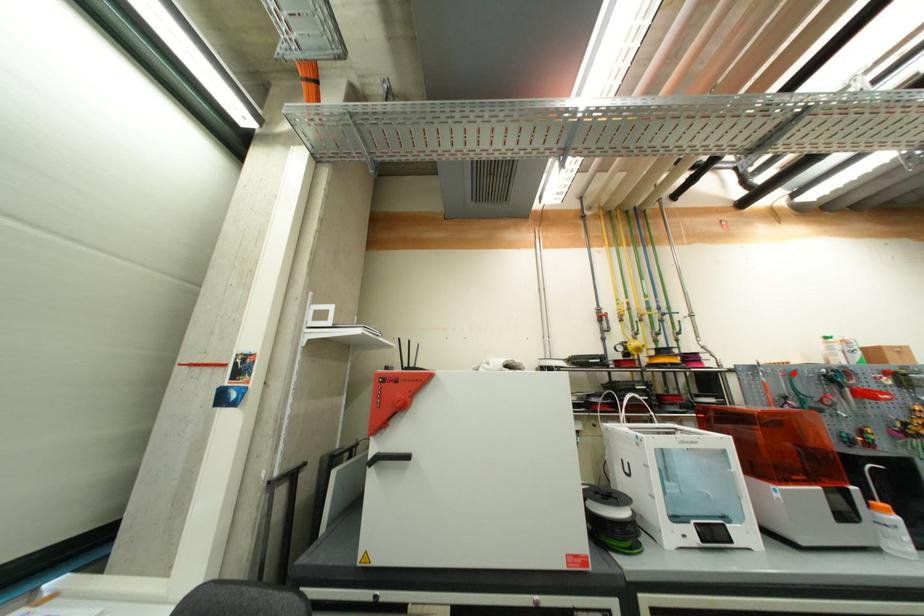
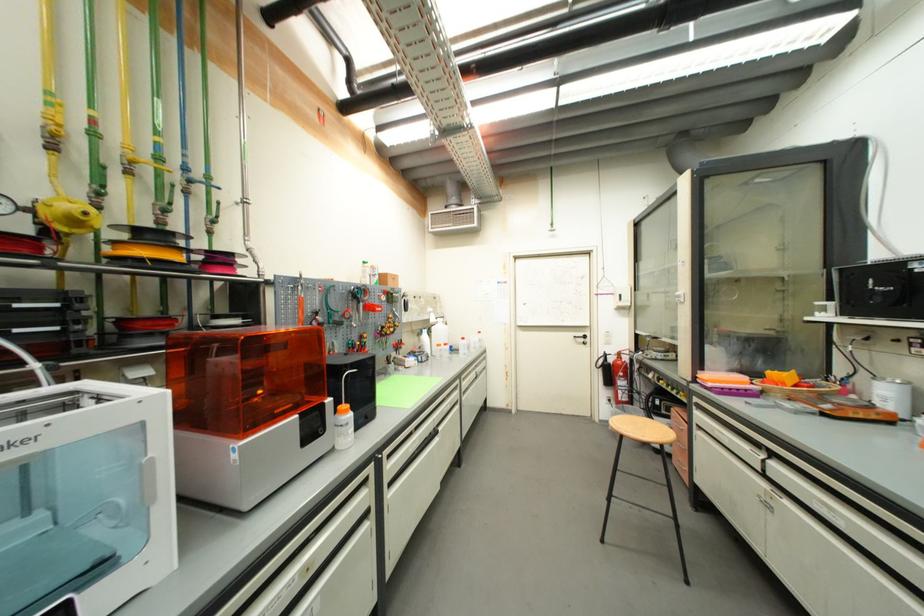
Find the pixel in the second image that matches the highlighted location in the first image.

(334, 289)